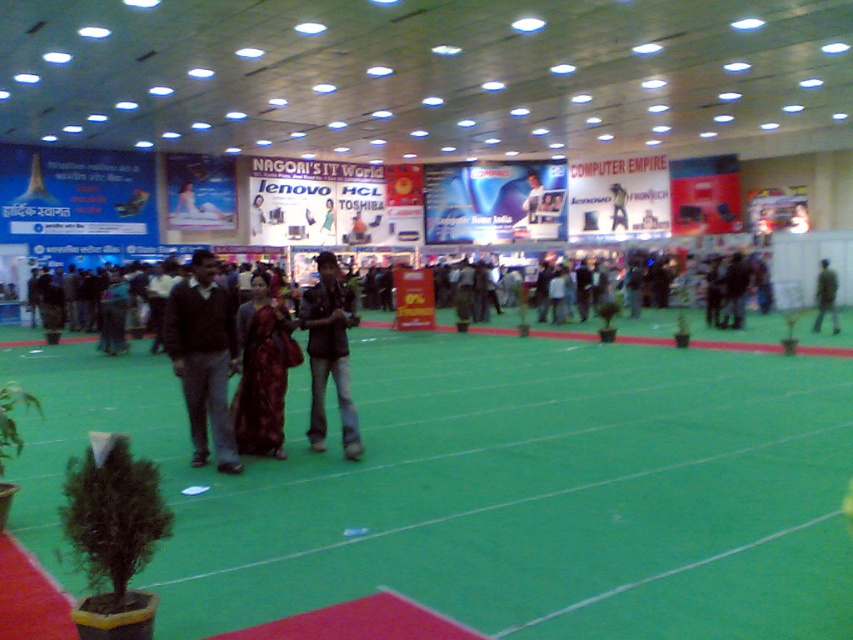
You are an attendee at the exhibition hall. You see the green artificial turf at center and the maroon silk saree at center. Which object is taller?

The maroon silk saree at center is taller than the green artificial turf at center.

You are an attendee at the exhibition and want to take a photo of the maroon silk saree at center and denim jacket at center. Since both are displayed at the center, which one is closer to you?

The maroon silk saree at center is in front of the denim jacket at center, so it is closer to you.

You are at the entrance of the exhibition hall and want to find the maroon silk saree at center. Based on the coordinates provided, in which direction should you move from the entrance to locate it?

The maroon silk saree at center is located at coordinates point (262, 371). Since the entrance is typically at the edge of the space, moving towards the center would place you closer to the saree.